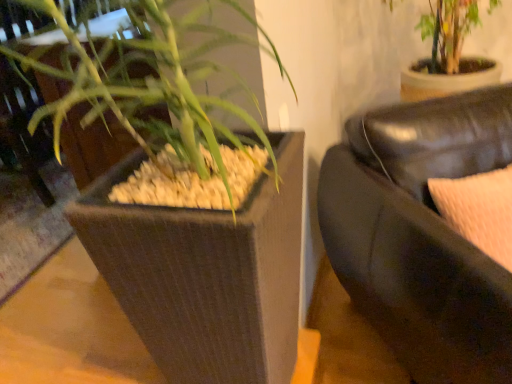
Question: Is point (31, 64) positioned closer to the camera than point (240, 357)?

Choices:
 (A) farther
 (B) closer

Answer: (B)

Question: Is green leafy plant at upper left inside or outside of brown textured planter at left?

Choices:
 (A) inside
 (B) outside

Answer: (B)

Question: Based on their relative distances, which object is nearer to the black leather couch at right?

Choices:
 (A) green leafy plant at upper left
 (B) brown textured planter at left

Answer: (B)

Question: Based on their relative distances, which object is nearer to the brown textured planter at left?

Choices:
 (A) black leather couch at right
 (B) green leafy plant at upper left

Answer: (B)